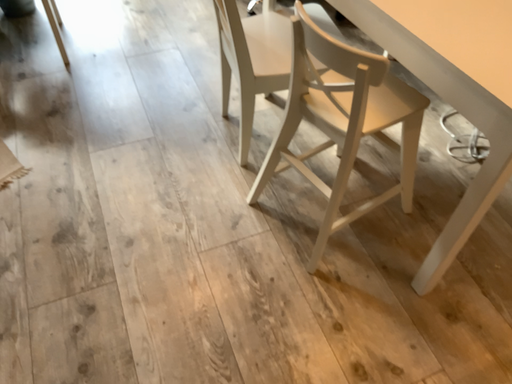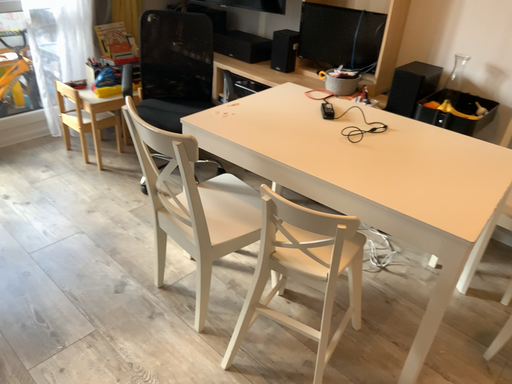
Question: Which way did the camera rotate in the video?

Choices:
 (A) rotated left
 (B) rotated right

Answer: (B)